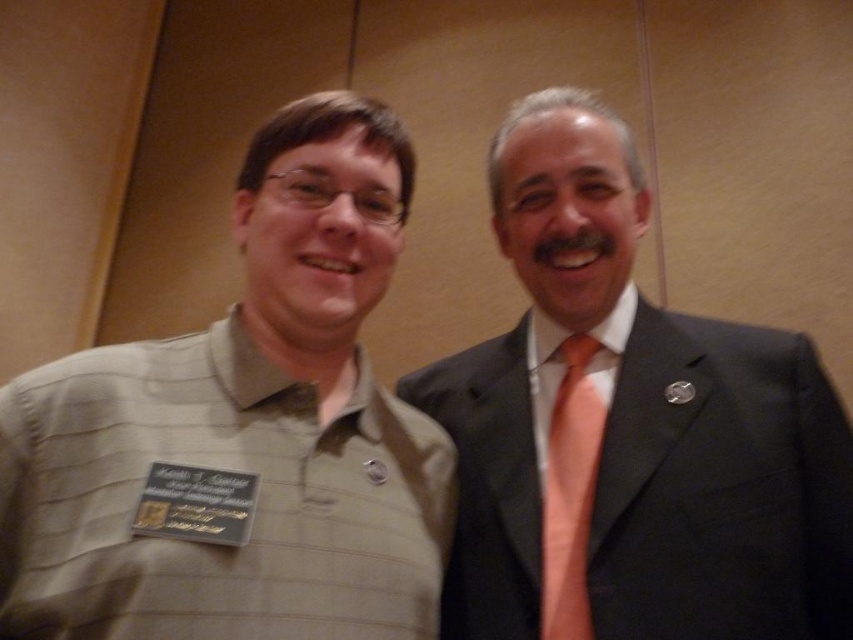
Question: Can you confirm if green striped shirt at center is thinner than orange silk tie at right?

Choices:
 (A) yes
 (B) no

Answer: (B)

Question: Among these objects, which one is nearest to the camera?

Choices:
 (A) matte black suit at right
 (B) orange silk tie at right
 (C) green striped shirt at center

Answer: (C)

Question: Can you confirm if green striped shirt at center is smaller than orange silk tie at right?

Choices:
 (A) yes
 (B) no

Answer: (B)

Question: Which point is closer to the camera?

Choices:
 (A) matte black suit at right
 (B) orange silk tie at right

Answer: (A)

Question: Which of these objects is positioned farthest from the orange silk tie at right?

Choices:
 (A) matte black suit at right
 (B) green striped shirt at center

Answer: (B)

Question: Does matte black suit at right have a smaller size compared to orange silk tie at right?

Choices:
 (A) yes
 (B) no

Answer: (B)